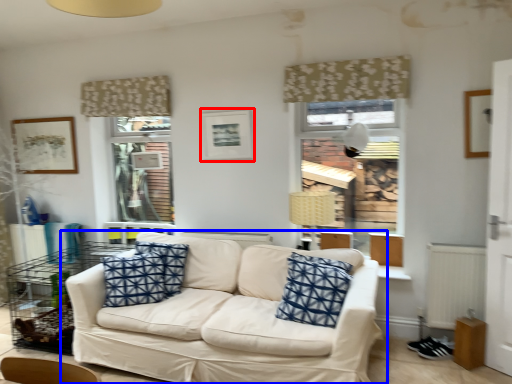
Question: Among these objects, which one is farthest to the camera, picture frame (highlighted by a red box) or studio couch (highlighted by a blue box)?

Choices:
 (A) picture frame
 (B) studio couch

Answer: (A)